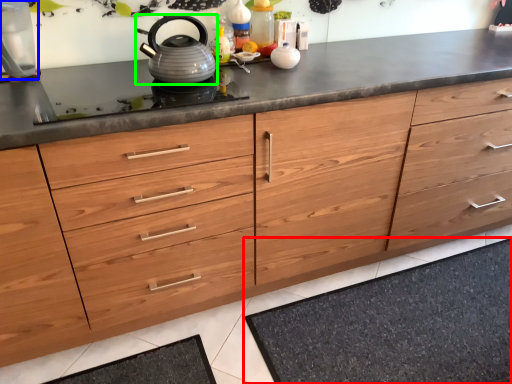
Question: Which is nearer to the bath mat (highlighted by a red box)? appliance (highlighted by a blue box) or kettle (highlighted by a green box).

Choices:
 (A) appliance
 (B) kettle

Answer: (B)